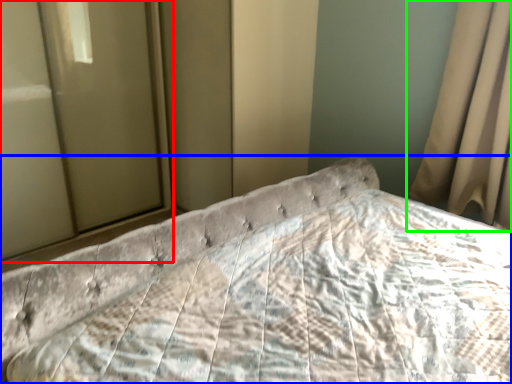
Question: Which object is the farthest from glass door (highlighted by a red box)? Choose among these: bed (highlighted by a blue box) or curtain (highlighted by a green box).

Choices:
 (A) bed
 (B) curtain

Answer: (B)